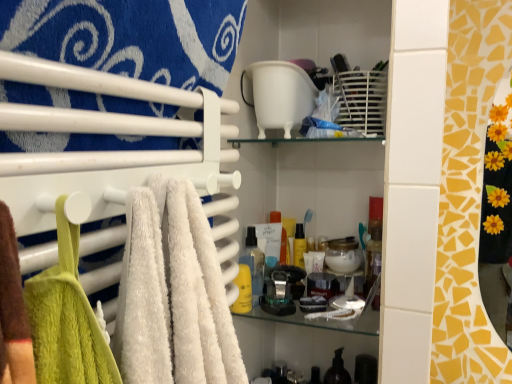
Question: Should I look upward or downward to see translucent plastic spray bottle at center, placed as the third toiletry when sorted from bottom to top?

Choices:
 (A) up
 (B) down

Answer: (B)

Question: From a real-world perspective, does yellow matte bottle at center, the 1th toiletry when ordered from left to right, sit lower than white soft towel at left?

Choices:
 (A) no
 (B) yes

Answer: (B)

Question: Are yellow matte bottle at center, arranged as the second toiletry when ordered from the bottom, and white soft towel at left beside each other?

Choices:
 (A) yes
 (B) no

Answer: (B)

Question: Is yellow matte bottle at center, the 1th toiletry when ordered from left to right, turned away from white soft towel at left?

Choices:
 (A) yes
 (B) no

Answer: (B)

Question: From the image's perspective, is yellow matte bottle at center, the 1th toiletry when ordered from left to right, above white soft towel at left?

Choices:
 (A) yes
 (B) no

Answer: (B)

Question: Is the position of yellow matte bottle at center, which is the 1th toiletry in front-to-back order, more distant than that of white soft towel at left?

Choices:
 (A) no
 (B) yes

Answer: (B)

Question: Considering the relative sizes of yellow matte bottle at center, the 1th toiletry when ordered from left to right, and white soft towel at left in the image provided, is yellow matte bottle at center, the 1th toiletry when ordered from left to right, smaller than white soft towel at left?

Choices:
 (A) yes
 (B) no

Answer: (A)

Question: Is yellow matte bottle at center, arranged as the second toiletry when ordered from the bottom, oriented away from translucent plastic spray bottle at center, which is the 2th toiletry in back-to-front order?

Choices:
 (A) no
 (B) yes

Answer: (B)

Question: From the image's perspective, is yellow matte bottle at center, the 1th toiletry when ordered from left to right, on top of translucent plastic spray bottle at center, placed as the third toiletry when sorted from bottom to top?

Choices:
 (A) yes
 (B) no

Answer: (B)

Question: Is yellow matte bottle at center, marked as the 2th toiletry in a top-to-bottom arrangement, beside translucent plastic spray bottle at center, the second toiletry from the front?

Choices:
 (A) yes
 (B) no

Answer: (A)

Question: Is translucent plastic spray bottle at center, which is the 2th toiletry in back-to-front order, located within yellow matte bottle at center, arranged as the second toiletry when ordered from the bottom?

Choices:
 (A) no
 (B) yes

Answer: (A)

Question: Is yellow matte bottle at center, marked as the 2th toiletry in a top-to-bottom arrangement, smaller than translucent plastic spray bottle at center, the 1th toiletry when ordered from top to bottom?

Choices:
 (A) no
 (B) yes

Answer: (B)

Question: From a real-world perspective, is yellow matte bottle at center, the 1th toiletry when ordered from left to right, physically above translucent plastic spray bottle at center, placed as the third toiletry when sorted from bottom to top?

Choices:
 (A) no
 (B) yes

Answer: (A)

Question: Would you say translucent plastic spray bottle at center, placed as the third toiletry when sorted from bottom to top, contains translucent plastic soap dispenser at lower center, positioned as the 3th toiletry in front-to-back order?

Choices:
 (A) yes
 (B) no

Answer: (B)